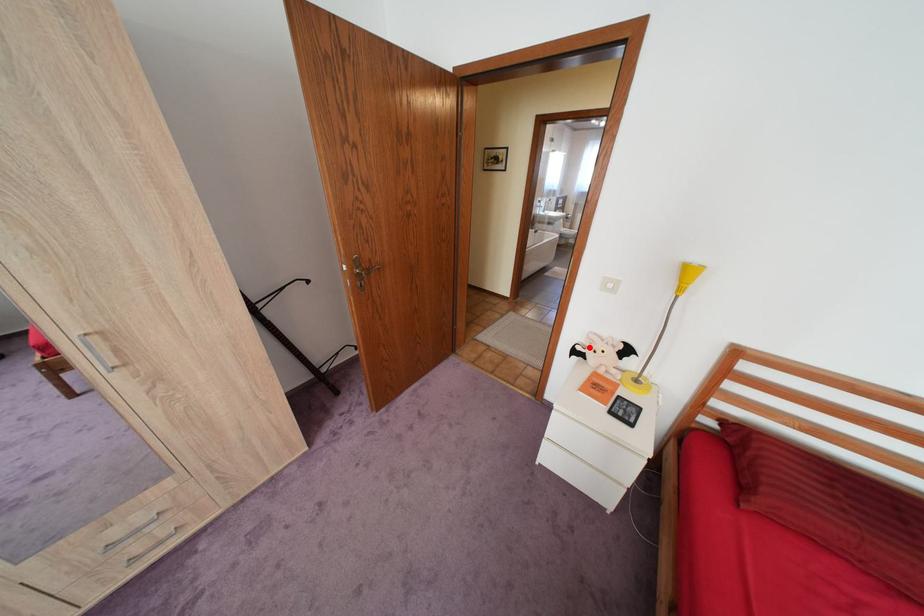
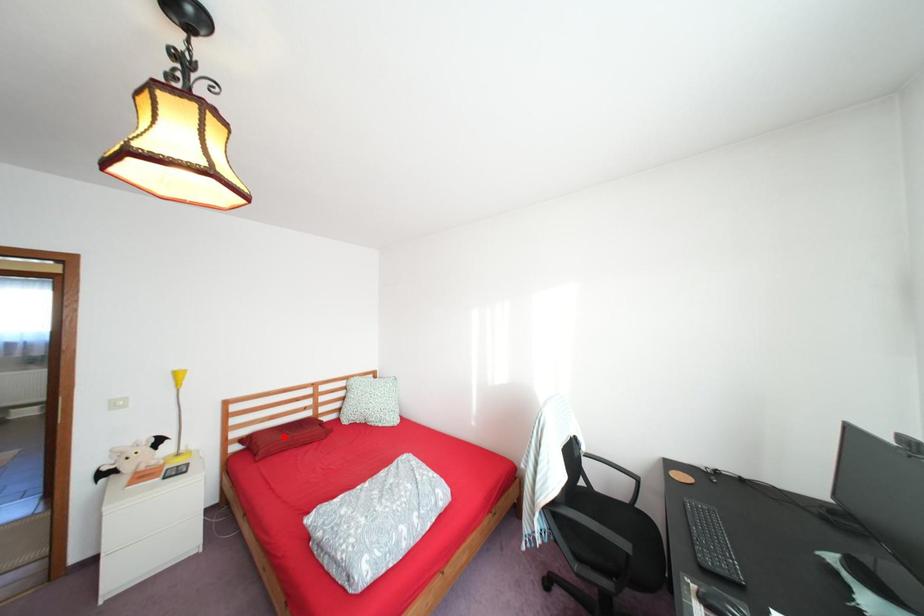
I am providing you with two images of the same scene from different viewpoints. A red point is marked on the first image and another point is marked on the second image. Is the red point in image1 aligned with the point shown in image2?

No